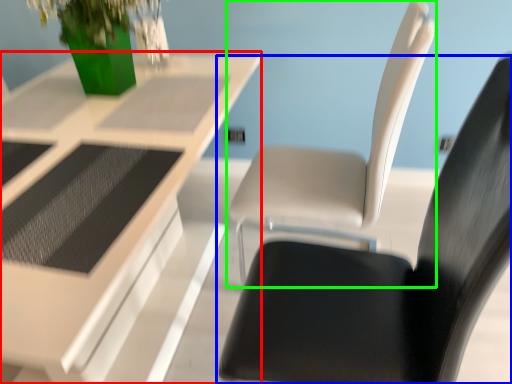
Question: Estimate the real-world distances between objects in this image. Which object is closer to table (highlighted by a red box), chair (highlighted by a blue box) or chair (highlighted by a green box)?

Choices:
 (A) chair
 (B) chair

Answer: (B)